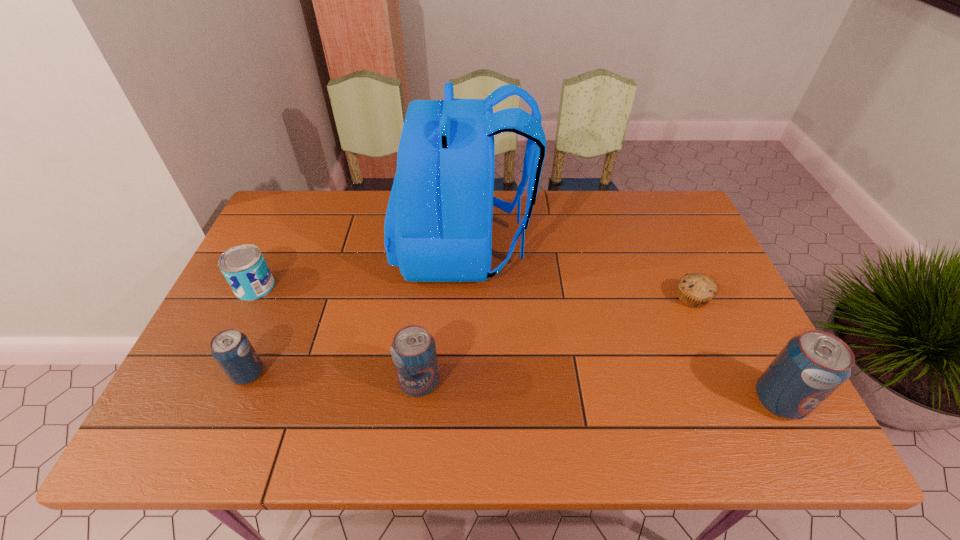
Where is `free space located on the left of the fifth shortest object`? The image size is (960, 540). free space located on the left of the fifth shortest object is located at coordinates pyautogui.click(x=597, y=400).

You are a GUI agent. You are given a task and a screenshot of the screen. Output one action in this format:
    pyautogui.click(x=<x>, y=<y>)
    Task: Click on the vacant area situated 0.050m on the back of the backpack
    Image resolution: width=960 pixels, height=540 pixels.
    Given the screenshot: What is the action you would take?
    pyautogui.click(x=547, y=247)

Locate an element on the screen. This screenshot has width=960, height=540. free space located on the front of the shortest object is located at coordinates (738, 402).

This screenshot has width=960, height=540. What are the coordinates of `free location located on the right of the fifth tallest object` in the screenshot? It's located at (419, 287).

The width and height of the screenshot is (960, 540). What are the coordinates of `object that is positioned at the far edge` in the screenshot? It's located at tap(438, 227).

Locate an element on the screen. Image resolution: width=960 pixels, height=540 pixels. pop soda situated at the left edge is located at coordinates (231, 349).

What are the coordinates of `can that is positioned at the left edge` in the screenshot? It's located at (244, 267).

The height and width of the screenshot is (540, 960). I want to click on pop soda that is at the right edge, so click(813, 365).

Where is `muffin located at the right edge`? This screenshot has width=960, height=540. muffin located at the right edge is located at coordinates (695, 290).

Locate an element on the screen. The width and height of the screenshot is (960, 540). object at the near left corner is located at coordinates (231, 349).